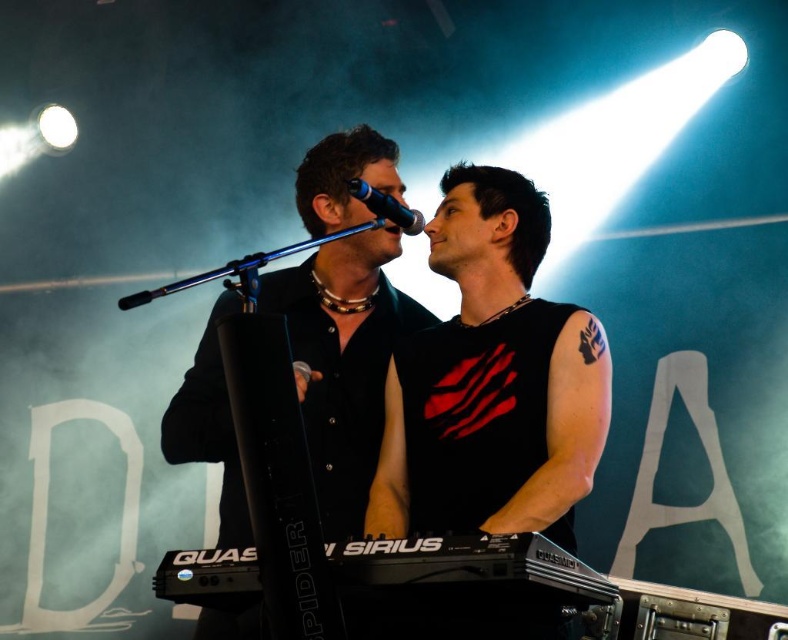
In the scene shown: Who is taller, black matte tank top at center or black plastic keyboard at lower center?

black matte tank top at center is taller.

Is black matte tank top at center shorter than black plastic keyboard at lower center?

Incorrect, black matte tank top at center's height does not fall short of black plastic keyboard at lower center's.

This screenshot has height=640, width=788. What do you see at coordinates (492, 380) in the screenshot?
I see `black matte tank top at center` at bounding box center [492, 380].

This screenshot has height=640, width=788. In order to click on black matte tank top at center in this screenshot , I will do `click(492, 380)`.

This screenshot has width=788, height=640. In order to click on black matte tank top at center in this screenshot , I will do `click(492, 380)`.

This screenshot has width=788, height=640. What do you see at coordinates (492, 380) in the screenshot?
I see `black matte tank top at center` at bounding box center [492, 380].

Image resolution: width=788 pixels, height=640 pixels. Identify the location of black matte tank top at center. (492, 380).

Is black matte shirt at center positioned in front of black metallic microphone at upper center?

That is True.

Can you confirm if black matte shirt at center is bigger than black metallic microphone at upper center?

Yes, black matte shirt at center is bigger than black metallic microphone at upper center.

Does point (336, 228) lie in front of point (381, 196)?

No, it is not.

Identify the location of black matte shirt at center. Image resolution: width=788 pixels, height=640 pixels. click(x=344, y=360).